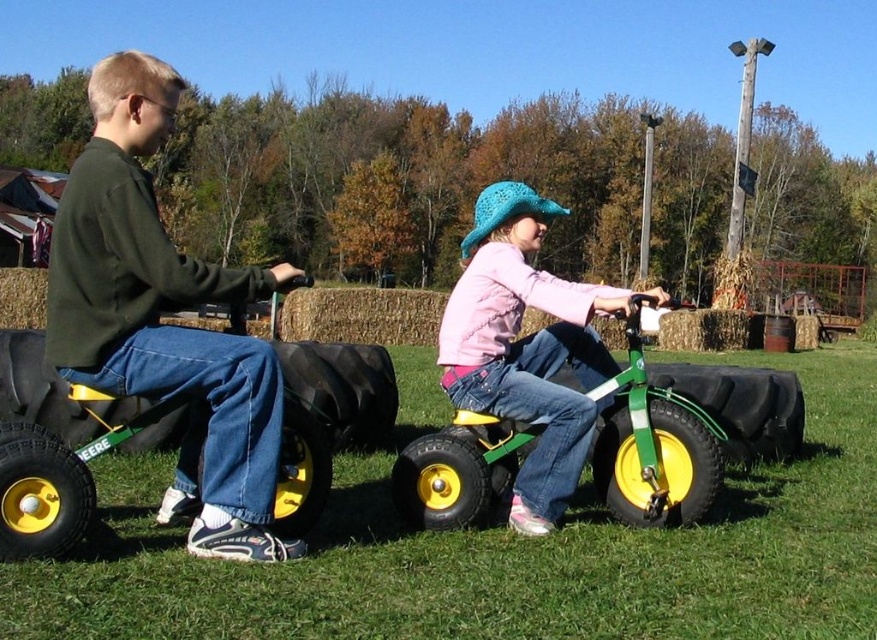
Question: Which object is closer to the camera taking this photo?

Choices:
 (A) rubberized green wagon at left
 (B) matte green tricycle at left
 (C) green matte tricycle at center
 (D) pink matte jacket at center

Answer: (A)

Question: Is pink matte jacket at center closer to the viewer compared to rubberized green wagon at left?

Choices:
 (A) yes
 (B) no

Answer: (B)

Question: Which point appears farthest from the camera in this image?

Choices:
 (A) (405, 497)
 (B) (225, 486)
 (C) (581, 435)
 (D) (15, 368)

Answer: (D)

Question: Is green matte tricycle at center above pink matte jacket at center?

Choices:
 (A) no
 (B) yes

Answer: (A)

Question: Is the position of green matte tricycle at center less distant than that of rubberized green wagon at left?

Choices:
 (A) no
 (B) yes

Answer: (A)

Question: Which object is closer to the camera taking this photo?

Choices:
 (A) pink matte jacket at center
 (B) green matte tricycle at center

Answer: (B)